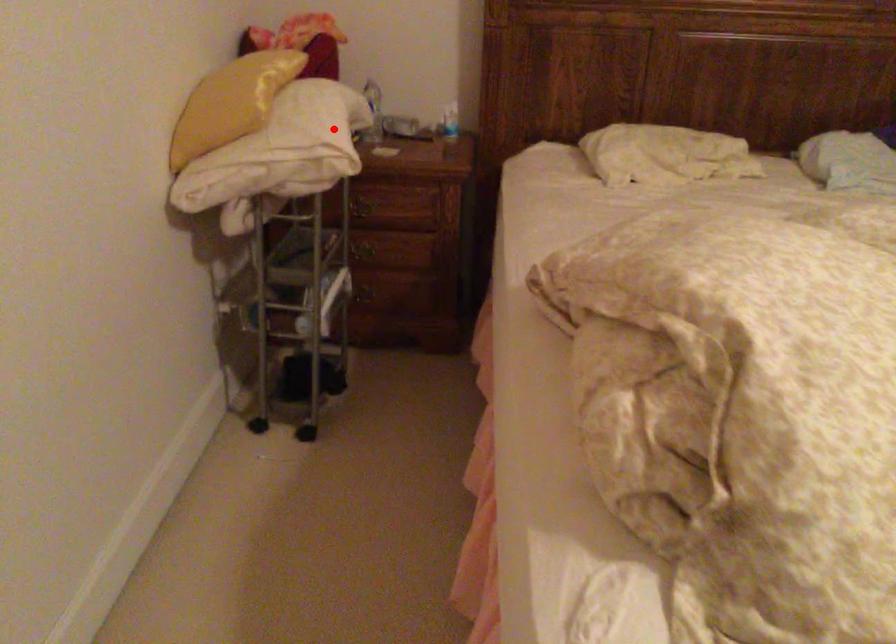
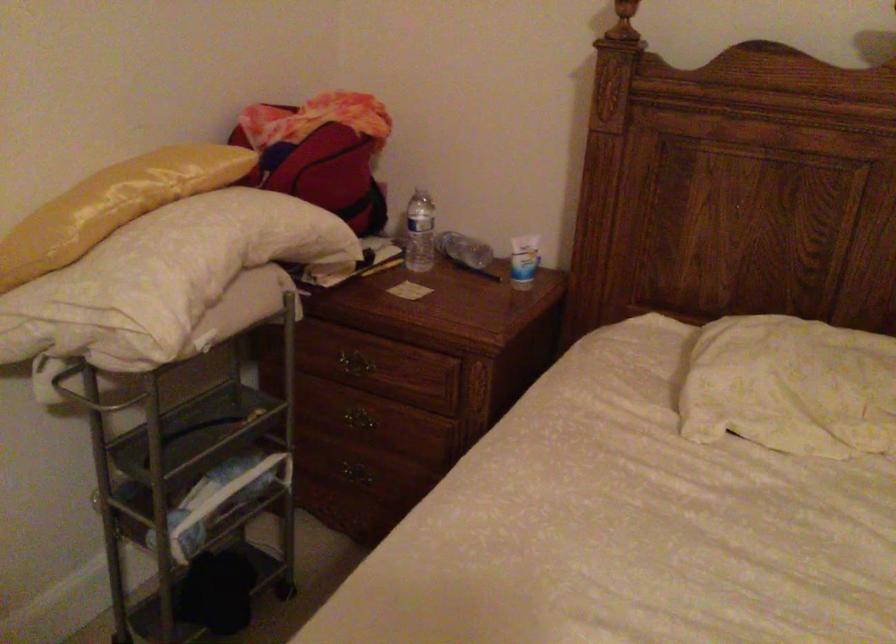
Question: I am providing you with two images of the same scene from different viewpoints. Given a red point in image1, look at the same physical point in image2. Is it:

Choices:
 (A) Closer to the viewpoint
 (B) Farther from the viewpoint

Answer: (A)